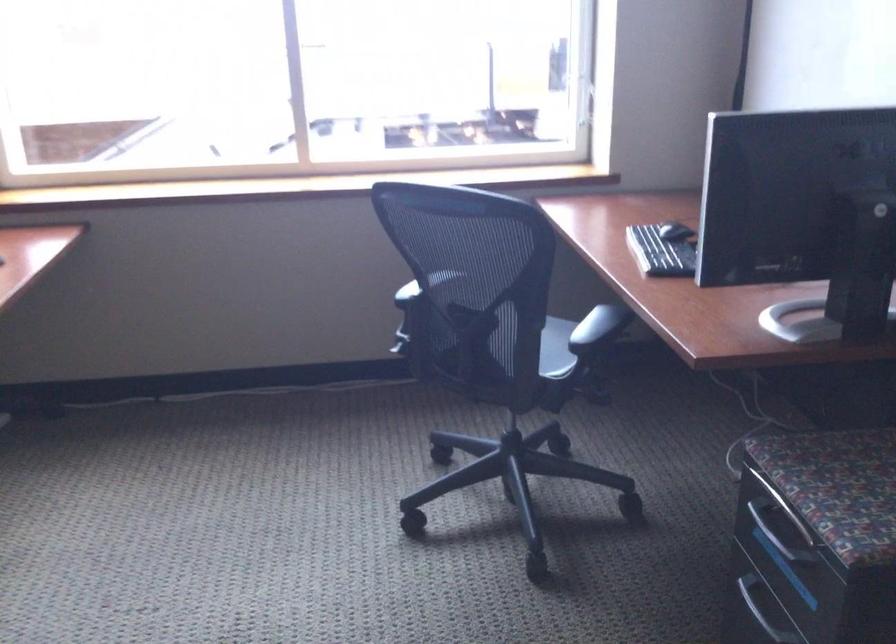
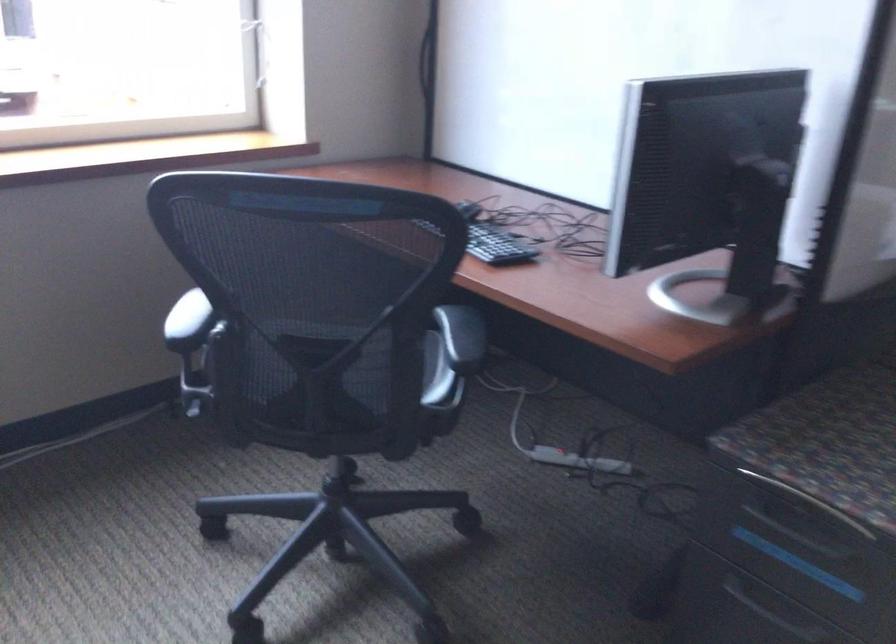
Question: Based on the continuous images, in which direction is the camera rotating? Reply with the corresponding letter.

Choices:
 (A) Left
 (B) Right
 (C) Up
 (D) Down

Answer: (B)